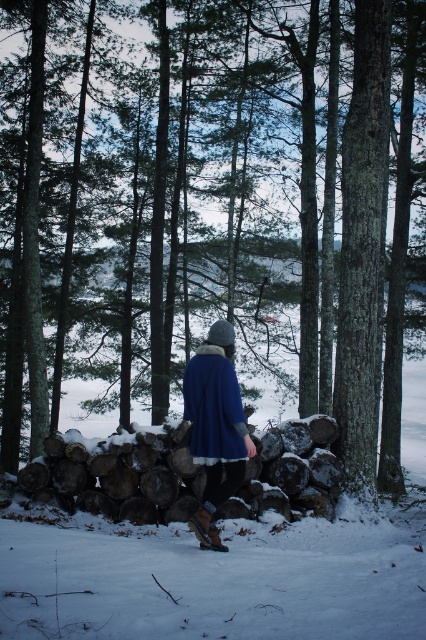
Question: Which object is positioned farthest from the blue woolen cloak at center?

Choices:
 (A) snow-covered woodpile at center
 (B) blue woolen coat at center

Answer: (A)

Question: Does blue woolen coat at center have a larger size compared to blue woolen cloak at center?

Choices:
 (A) yes
 (B) no

Answer: (A)

Question: Is blue woolen coat at center thinner than blue woolen cloak at center?

Choices:
 (A) no
 (B) yes

Answer: (A)

Question: Can you confirm if snow-covered woodpile at center is wider than blue woolen coat at center?

Choices:
 (A) yes
 (B) no

Answer: (A)

Question: Among these points, which one is farthest from the camera?

Choices:
 (A) (209, 444)
 (B) (212, 484)
 (C) (155, 497)

Answer: (C)

Question: Based on their relative distances, which object is farther from the blue woolen cloak at center?

Choices:
 (A) blue woolen coat at center
 (B) snow-covered woodpile at center

Answer: (B)